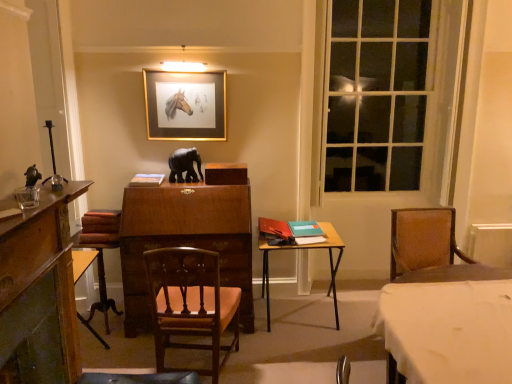
Question: Does wooden chair at center contain white cloth-covered table at lower right, the first table from the front?

Choices:
 (A) no
 (B) yes

Answer: (A)

Question: Is wooden chair at center shorter than white cloth-covered table at lower right, arranged as the 1th table when viewed from the right?

Choices:
 (A) no
 (B) yes

Answer: (A)

Question: Can you confirm if wooden chair at center is taller than white cloth-covered table at lower right, which is counted as the second table, starting from the back?

Choices:
 (A) yes
 (B) no

Answer: (A)

Question: From a real-world perspective, is wooden chair at center on top of white cloth-covered table at lower right, which is counted as the second table, starting from the back?

Choices:
 (A) yes
 (B) no

Answer: (A)

Question: Can you confirm if wooden chair at center is positioned to the left of white cloth-covered table at lower right, which is counted as the second table, starting from the back?

Choices:
 (A) yes
 (B) no

Answer: (A)

Question: Based on their positions, is wooden table at center, which is counted as the second table, starting from the front, located to the left or right of wooden chair at center?

Choices:
 (A) left
 (B) right

Answer: (B)

Question: Looking at their shapes, would you say wooden table at center, the second table when ordered from right to left, is wider or thinner than wooden chair at center?

Choices:
 (A) wide
 (B) thin

Answer: (A)

Question: From a real-world perspective, is wooden table at center, which is counted as the second table, starting from the front, positioned above or below wooden chair at center?

Choices:
 (A) below
 (B) above

Answer: (A)

Question: In the image, is wooden table at center, which is counted as the second table, starting from the front, positioned in front of or behind wooden chair at center?

Choices:
 (A) front
 (B) behind

Answer: (B)

Question: Considering their positions, is wooden chair at center located in front of or behind clear glass window at right?

Choices:
 (A) front
 (B) behind

Answer: (A)

Question: From a real-world perspective, relative to clear glass window at right, is wooden chair at center vertically above or below?

Choices:
 (A) below
 (B) above

Answer: (A)

Question: From the image's perspective, is wooden chair at center above or below clear glass window at right?

Choices:
 (A) below
 (B) above

Answer: (A)

Question: Looking at their shapes, would you say wooden chair at center is wider or thinner than clear glass window at right?

Choices:
 (A) thin
 (B) wide

Answer: (B)

Question: Looking at their shapes, would you say wooden chair at center is wider or thinner than white cloth-covered table at lower right, the 2th table viewed from the left?

Choices:
 (A) wide
 (B) thin

Answer: (B)

Question: From the image's perspective, is wooden chair at center located above or below white cloth-covered table at lower right, which is counted as the second table, starting from the back?

Choices:
 (A) above
 (B) below

Answer: (A)